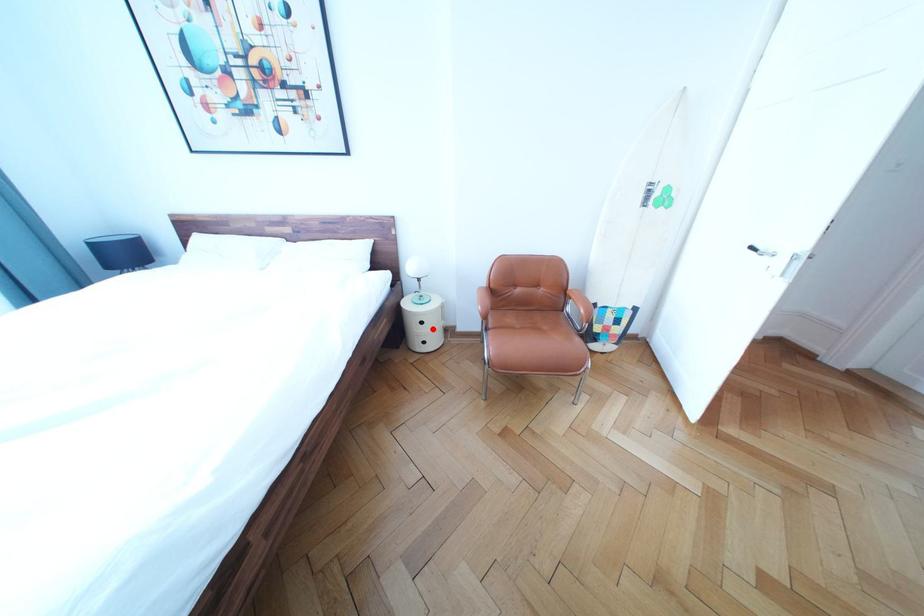
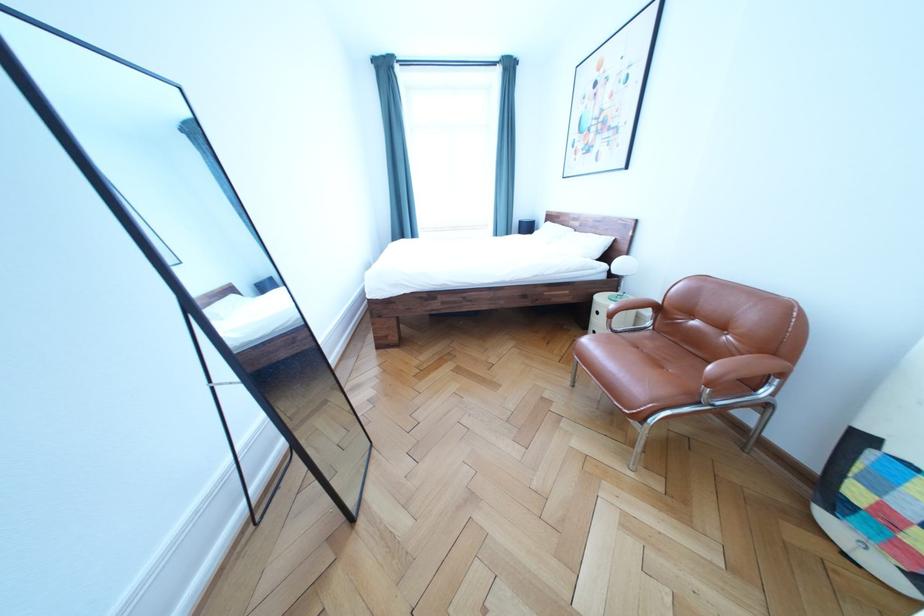
Question: A red point is marked in image1. In image2, is the corresponding 3D point closer to the camera or farther? Reply with the corresponding letter.

Choices:
 (A) The corresponding 3D point is closer.
 (B) The corresponding 3D point is farther.

Answer: (A)